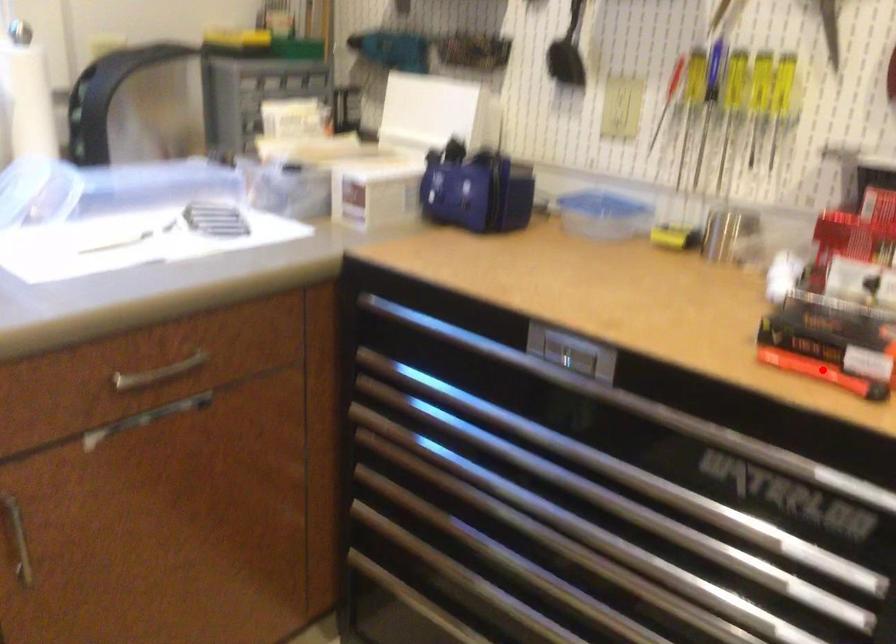
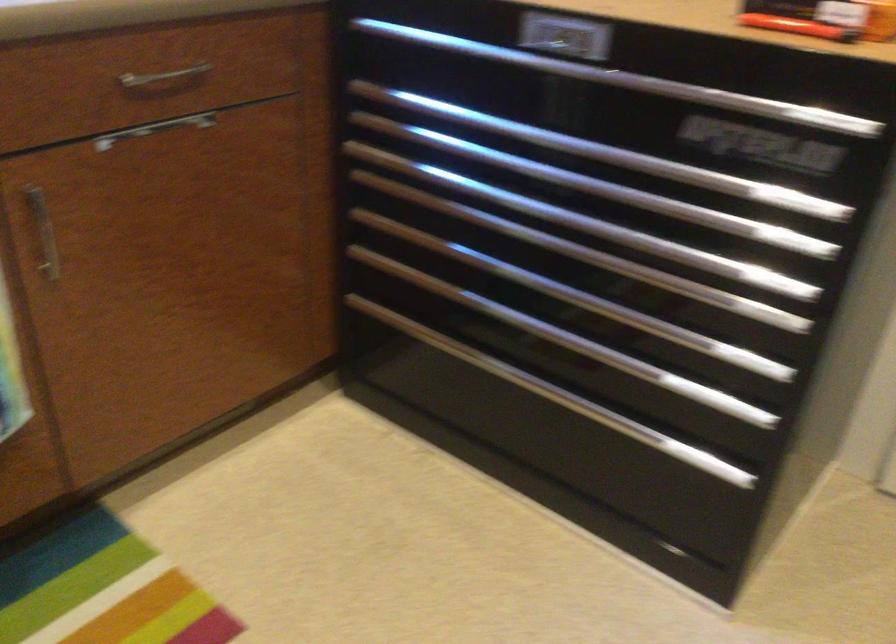
Locate, in the second image, the point that corresponds to the highlighted location in the first image.

(797, 26)